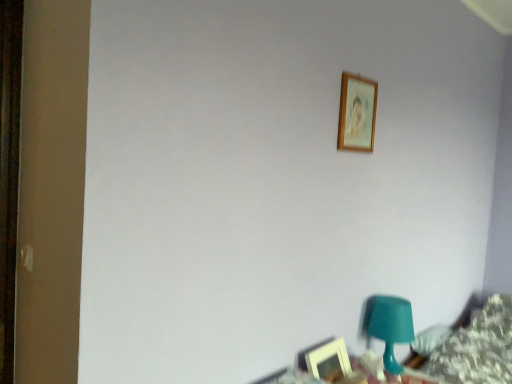
Image resolution: width=512 pixels, height=384 pixels. Describe the element at coordinates (357, 113) in the screenshot. I see `wooden picture frame at upper center, the 2th picture frame in the bottom-to-top sequence` at that location.

Locate an element on the screen. This screenshot has width=512, height=384. teal plastic table at lower right is located at coordinates (367, 367).

Is teal plastic table at lower right completely or partially outside of teal plastic table lamp at lower right?

Yes, teal plastic table at lower right is located beyond the bounds of teal plastic table lamp at lower right.

Is teal plastic table at lower right turned away from teal plastic table lamp at lower right?

No, teal plastic table at lower right is not facing the opposite direction of teal plastic table lamp at lower right.

Is the position of teal plastic table at lower right more distant than that of teal plastic table lamp at lower right?

That is False.

You are a GUI agent. You are given a task and a screenshot of the screen. Output one action in this format:
    pyautogui.click(x=<x>, y=<y>)
    Task: Click on the picture frame that is above the teal plastic table lamp at lower right (from the image's perspective)
    
    Given the screenshot: What is the action you would take?
    pyautogui.click(x=357, y=113)

Between wooden picture frame at upper center, the 2th picture frame in the bottom-to-top sequence, and teal plastic table lamp at lower right, which one appears on the left side from the viewer's perspective?

wooden picture frame at upper center, the 2th picture frame in the bottom-to-top sequence, is more to the left.

Is wooden picture frame at upper center, the 2th picture frame in the bottom-to-top sequence, in front of teal plastic table lamp at lower right?

Yes, wooden picture frame at upper center, the 2th picture frame in the bottom-to-top sequence, is closer to the camera.

Looking at this image, based on their positions, is wooden picture frame at lower right, placed as the first picture frame when sorted from bottom to top, located to the left or right of teal plastic table at lower right?

In the image, wooden picture frame at lower right, placed as the first picture frame when sorted from bottom to top, appears on the left side of teal plastic table at lower right.

Considering their positions, is wooden picture frame at lower right, which ranks as the second picture frame in top-to-bottom order, located in front of or behind teal plastic table at lower right?

wooden picture frame at lower right, which ranks as the second picture frame in top-to-bottom order, is positioned farther from the viewer than teal plastic table at lower right.

Looking at this image, is wooden picture frame at lower right, placed as the first picture frame when sorted from bottom to top, oriented away from teal plastic table at lower right?

No, wooden picture frame at lower right, placed as the first picture frame when sorted from bottom to top, is not facing away from teal plastic table at lower right.

Could you tell me if wooden picture frame at upper center, the 2th picture frame in the bottom-to-top sequence, is turned towards teal plastic table at lower right?

No, wooden picture frame at upper center, the 2th picture frame in the bottom-to-top sequence, does not turn towards teal plastic table at lower right.

Is wooden picture frame at upper center, which appears as the first picture frame when viewed from the top, wider or thinner than teal plastic table at lower right?

Considering their sizes, wooden picture frame at upper center, which appears as the first picture frame when viewed from the top, looks slimmer than teal plastic table at lower right.

Between point (344, 81) and point (431, 380), which one is positioned in front?

The point (344, 81) is in front.

What's the angular difference between wooden picture frame at lower right, which ranks as the second picture frame in top-to-bottom order, and teal plastic table lamp at lower right's facing directions?

The angle between the facing direction of wooden picture frame at lower right, which ranks as the second picture frame in top-to-bottom order, and the facing direction of teal plastic table lamp at lower right is 0.0012 degrees.

From the image's perspective, would you say wooden picture frame at lower right, placed as the first picture frame when sorted from bottom to top, is shown under teal plastic table lamp at lower right?

Yes, from the image's perspective, wooden picture frame at lower right, placed as the first picture frame when sorted from bottom to top, is below teal plastic table lamp at lower right.

In terms of size, does wooden picture frame at lower right, which ranks as the second picture frame in top-to-bottom order, appear bigger or smaller than teal plastic table lamp at lower right?

Considering their sizes, wooden picture frame at lower right, which ranks as the second picture frame in top-to-bottom order, takes up less space than teal plastic table lamp at lower right.

Looking at this image, considering the sizes of objects wooden picture frame at lower right, placed as the first picture frame when sorted from bottom to top, and teal plastic table lamp at lower right in the image provided, who is shorter, wooden picture frame at lower right, placed as the first picture frame when sorted from bottom to top, or teal plastic table lamp at lower right?

With less height is wooden picture frame at lower right, placed as the first picture frame when sorted from bottom to top.

In the scene shown: From a real-world perspective, which is physically above, teal plastic table at lower right or wooden picture frame at upper center, which appears as the first picture frame when viewed from the top?

In real-world perspective, wooden picture frame at upper center, which appears as the first picture frame when viewed from the top, is above.

From the image's perspective, is teal plastic table at lower right below wooden picture frame at upper center, the 2th picture frame in the bottom-to-top sequence?

Yes, from the image's perspective, teal plastic table at lower right is beneath wooden picture frame at upper center, the 2th picture frame in the bottom-to-top sequence.

Is teal plastic table at lower right looking in the opposite direction of wooden picture frame at upper center, which appears as the first picture frame when viewed from the top?

No, teal plastic table at lower right's orientation is not away from wooden picture frame at upper center, which appears as the first picture frame when viewed from the top.

From the teal plastic table at lower right, count 2nd picture frames backward and point to it. Please provide its 2D coordinates.

[(357, 113)]

Looking at this image, does teal plastic table lamp at lower right have a lesser width compared to teal plastic table at lower right?

Yes.

From the picture: From the image's perspective, does teal plastic table lamp at lower right appear higher than teal plastic table at lower right?

Indeed, from the image's perspective, teal plastic table lamp at lower right is shown above teal plastic table at lower right.

Is the depth of teal plastic table lamp at lower right less than that of teal plastic table at lower right?

No, it is behind teal plastic table at lower right.

Where is `table lamp behind the teal plastic table at lower right`? This screenshot has width=512, height=384. table lamp behind the teal plastic table at lower right is located at coordinates tap(388, 326).

Identify the location of table lamp that is above the teal plastic table at lower right (from the image's perspective). (388, 326).

Locate an element on the screen. The height and width of the screenshot is (384, 512). table lamp that is behind the wooden picture frame at upper center, which appears as the first picture frame when viewed from the top is located at coordinates (388, 326).

Based on the photo, which object lies further to the anchor point wooden picture frame at lower right, which ranks as the second picture frame in top-to-bottom order, teal plastic table at lower right or teal plastic table lamp at lower right?

teal plastic table lamp at lower right.

Based on the photo, when comparing their distances from wooden picture frame at upper center, which appears as the first picture frame when viewed from the top, does teal plastic table at lower right or teal plastic table lamp at lower right seem closer?

teal plastic table lamp at lower right lies closer to wooden picture frame at upper center, which appears as the first picture frame when viewed from the top, than the other object.

Based on their spatial positions, is wooden picture frame at lower right, which ranks as the second picture frame in top-to-bottom order, or teal plastic table lamp at lower right closer to teal plastic table at lower right?

Among the two, wooden picture frame at lower right, which ranks as the second picture frame in top-to-bottom order, is located nearer to teal plastic table at lower right.

Looking at the image, which one is located further to wooden picture frame at upper center, the 2th picture frame in the bottom-to-top sequence, wooden picture frame at lower right, placed as the first picture frame when sorted from bottom to top, or teal plastic table lamp at lower right?

Based on the image, wooden picture frame at lower right, placed as the first picture frame when sorted from bottom to top, appears to be further to wooden picture frame at upper center, the 2th picture frame in the bottom-to-top sequence.

Looking at the image, which one is located further to teal plastic table lamp at lower right, wooden picture frame at lower right, placed as the first picture frame when sorted from bottom to top, or wooden picture frame at upper center, which appears as the first picture frame when viewed from the top?

wooden picture frame at upper center, which appears as the first picture frame when viewed from the top.

When comparing their distances from teal plastic table at lower right, does teal plastic table lamp at lower right or wooden picture frame at lower right, which ranks as the second picture frame in top-to-bottom order, seem closer?

The object closer to teal plastic table at lower right is wooden picture frame at lower right, which ranks as the second picture frame in top-to-bottom order.

Looking at the image, which one is located further to wooden picture frame at lower right, which ranks as the second picture frame in top-to-bottom order, teal plastic table lamp at lower right or wooden picture frame at upper center, the 2th picture frame in the bottom-to-top sequence?

Among the two, wooden picture frame at upper center, the 2th picture frame in the bottom-to-top sequence, is located further to wooden picture frame at lower right, which ranks as the second picture frame in top-to-bottom order.

When comparing their distances from teal plastic table at lower right, does wooden picture frame at lower right, which ranks as the second picture frame in top-to-bottom order, or wooden picture frame at upper center, which appears as the first picture frame when viewed from the top, seem closer?

wooden picture frame at lower right, which ranks as the second picture frame in top-to-bottom order.

You are a GUI agent. You are given a task and a screenshot of the screen. Output one action in this format:
    pyautogui.click(x=<x>, y=<y>)
    Task: Click on the table between wooden picture frame at lower right, placed as the first picture frame when sorted from bottom to top, and teal plastic table lamp at lower right, in the horizontal direction
    This screenshot has width=512, height=384.
    Given the screenshot: What is the action you would take?
    pyautogui.click(x=367, y=367)

Identify the location of picture frame that lies between wooden picture frame at upper center, the 2th picture frame in the bottom-to-top sequence, and teal plastic table at lower right from top to bottom. (329, 361).

Find the location of `table lamp between wooden picture frame at upper center, the 2th picture frame in the bottom-to-top sequence, and wooden picture frame at lower right, which ranks as the second picture frame in top-to-bottom order, in the up-down direction`. table lamp between wooden picture frame at upper center, the 2th picture frame in the bottom-to-top sequence, and wooden picture frame at lower right, which ranks as the second picture frame in top-to-bottom order, in the up-down direction is located at coordinates (388, 326).

Find the location of a particular element. This screenshot has width=512, height=384. table lamp between wooden picture frame at upper center, the 2th picture frame in the bottom-to-top sequence, and teal plastic table at lower right, in the vertical direction is located at coordinates (388, 326).